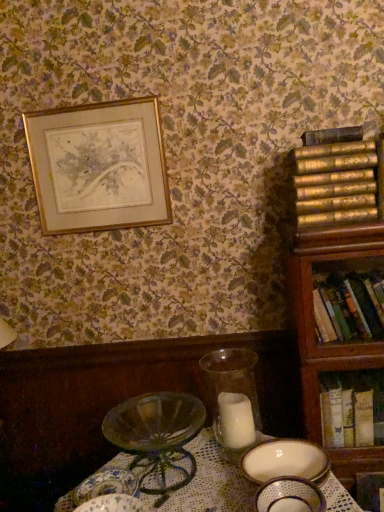
Image resolution: width=384 pixels, height=512 pixels. Find the location of `empty space that is ontop of hardcover book at right, the 2th book positioned from the bottom (from a real-world perspective)`. empty space that is ontop of hardcover book at right, the 2th book positioned from the bottom (from a real-world perspective) is located at coordinates (352, 271).